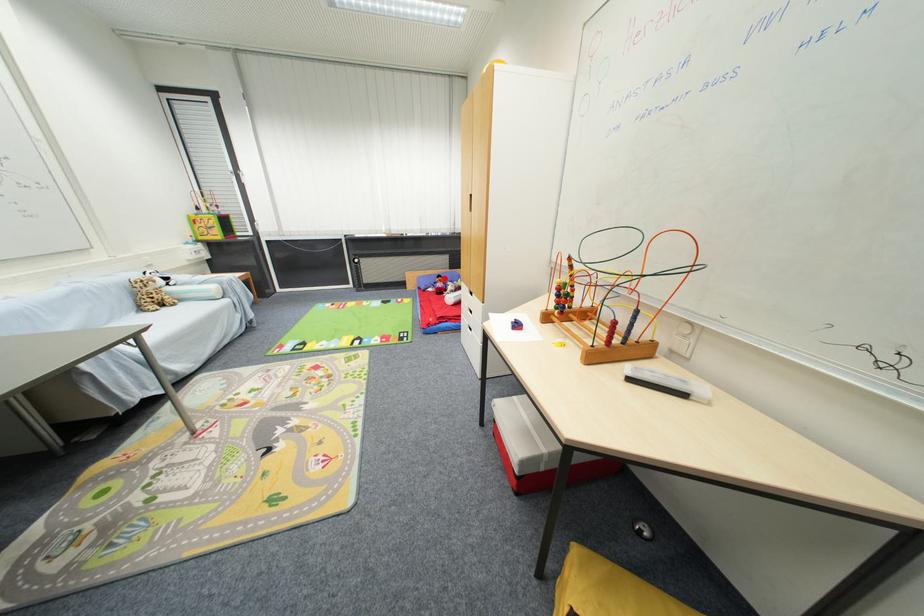
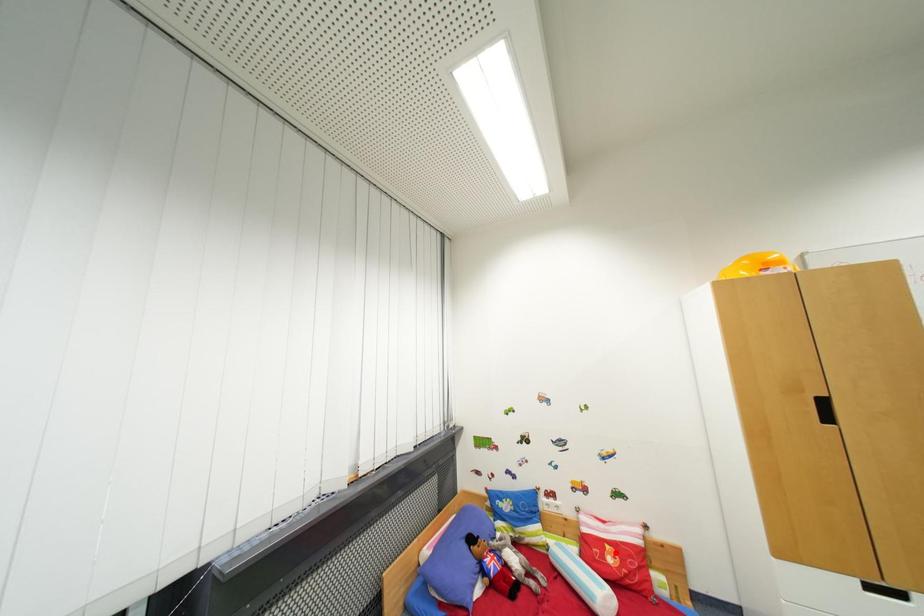
I am providing you with two images of the same scene from different viewpoints. A red point is marked on the first image and another point is marked on the second image. Is the red point in image1 aligned with the point shown in image2?

No